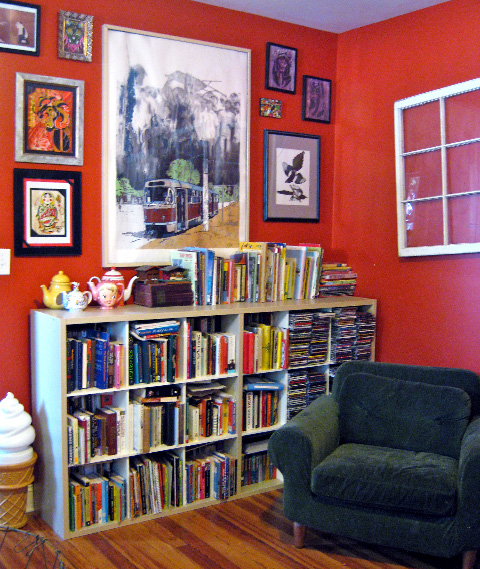
Find the location of a particular element. pictures is located at coordinates coord(313,183), coord(317,102), coord(290,68), coord(269,108), coord(194,144), coord(76,39), coord(26,28), coord(48,129), coord(55,205).